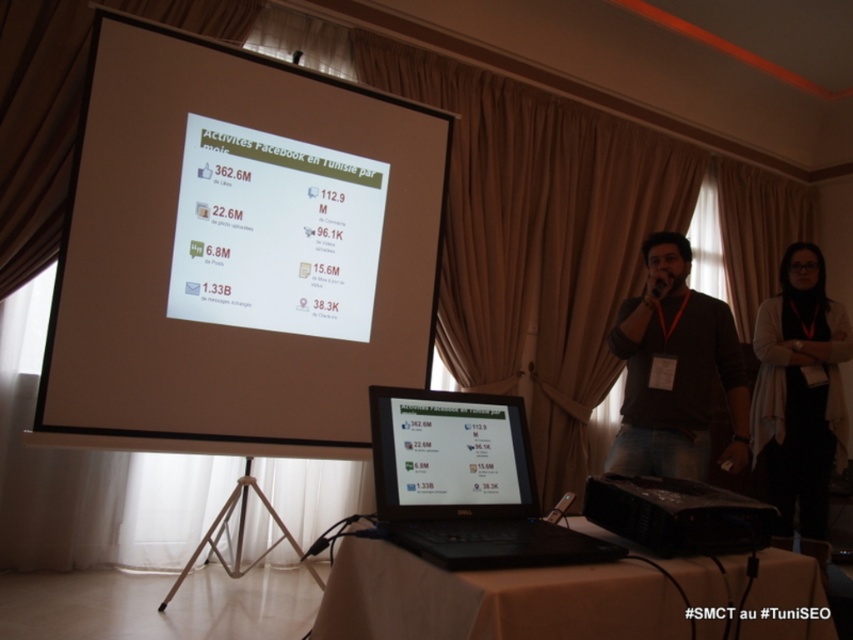
Question: Is black cardigan at center positioned behind black plastic projector at center?

Choices:
 (A) yes
 (B) no

Answer: (A)

Question: Does black cardigan at center appear on the right side of matte black laptop at center?

Choices:
 (A) no
 (B) yes

Answer: (B)

Question: Which point is closer to the camera taking this photo?

Choices:
 (A) (714, 490)
 (B) (357, 605)

Answer: (B)

Question: Which object appears closest to the camera in this image?

Choices:
 (A) matte black laptop at center
 (B) white matte projector screen at upper center

Answer: (A)

Question: Which is farther from the white matte projector screen at upper center?

Choices:
 (A) black plastic projector at center
 (B) brown cotton shirt at center

Answer: (A)

Question: Is white matte projector screen at upper center positioned in front of black matte laptop at center?

Choices:
 (A) yes
 (B) no

Answer: (B)